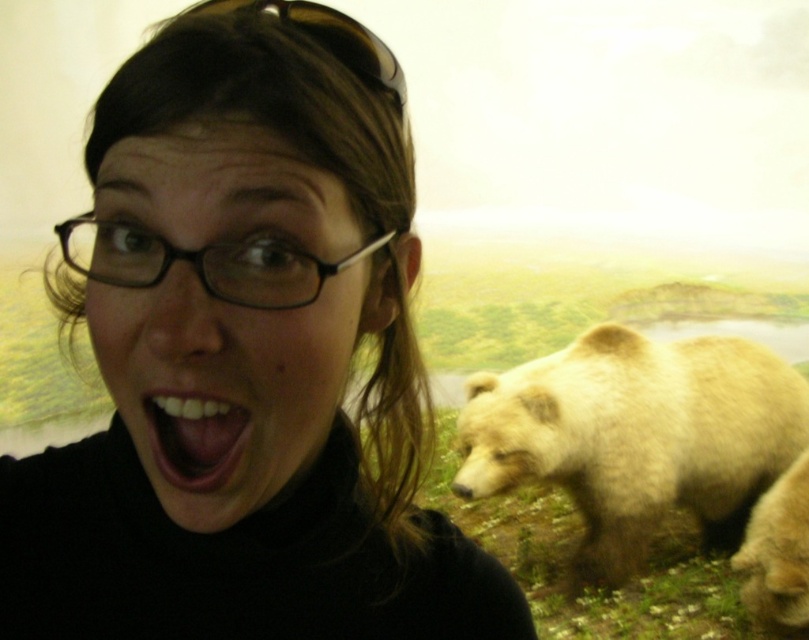
You are a visitor at the museum and notice two items on the person in the image. Which one is located below the other between the black plastic glasses at center and the black plastic sunglasses at upper center?

The black plastic glasses at center is positioned under the black plastic sunglasses at upper center, so the glasses are below the sunglasses.

You are a photographer trying to capture a clear photo of the black plastic glasses at center and the black plastic sunglasses at upper center. Since the scene is slightly out of focus, which object should you adjust your camera to focus on first to ensure clarity?

The black plastic glasses at center should be focused on first because it is larger in size than the black plastic sunglasses at upper center, making it more prominent in the image.

You are a photographer adjusting the focus of your camera to capture the black matte turtleneck at upper left and the white glossy teeth at center. Which object should you focus on first to ensure both are in sharp focus?

The black matte turtleneck at upper left is closer to the viewer than the white glossy teeth at center. To ensure both are in sharp focus, you should focus on the black matte turtleneck at upper left first, as it is the closer object, and adjust the depth of field accordingly.